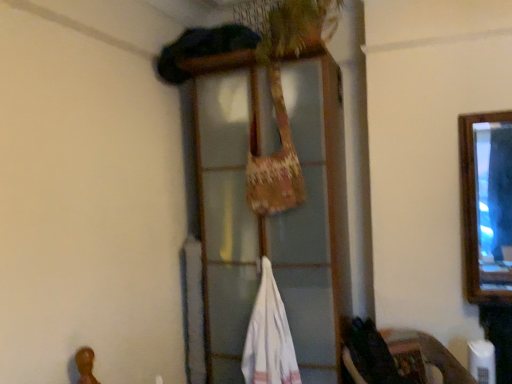
Question: From the image's perspective, is wooden frame at center located above or below white cotton towel at center?

Choices:
 (A) above
 (B) below

Answer: (A)

Question: Based on their sizes in the image, would you say wooden frame at center is bigger or smaller than white cotton towel at center?

Choices:
 (A) small
 (B) big

Answer: (B)

Question: Considering the positions of point pyautogui.click(x=246, y=309) and point pyautogui.click(x=272, y=281), is point pyautogui.click(x=246, y=309) closer or farther from the camera than point pyautogui.click(x=272, y=281)?

Choices:
 (A) farther
 (B) closer

Answer: (A)

Question: In the image, is white cotton towel at center on the left side or the right side of wooden frame at center?

Choices:
 (A) right
 (B) left

Answer: (B)

Question: From their relative heights in the image, would you say white cotton towel at center is taller or shorter than wooden frame at center?

Choices:
 (A) short
 (B) tall

Answer: (A)

Question: From a real-world perspective, relative to wooden frame at center, is white cotton towel at center vertically above or below?

Choices:
 (A) above
 (B) below

Answer: (B)

Question: Is point (286, 332) positioned closer to the camera than point (246, 122)?

Choices:
 (A) farther
 (B) closer

Answer: (B)